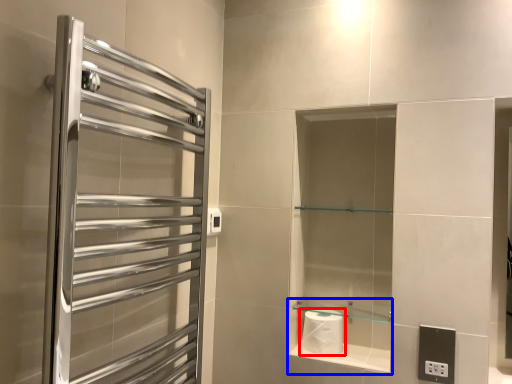
Question: Which object is closer to the camera taking this photo, toilet paper (highlighted by a red box) or cabinet (highlighted by a blue box)?

Choices:
 (A) toilet paper
 (B) cabinet

Answer: (B)